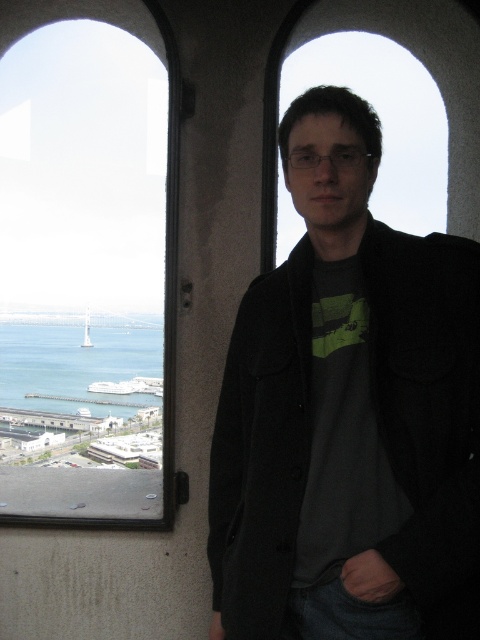
You are an interior designer assessing the space. You need to determine if the transparent glass window at upper left can accommodate a decorative shelf that is the same width as the black woolen jacket at center. Can the window fit the shelf?

The transparent glass window at upper left is wider than the black woolen jacket at center, so the shelf with the same width as the jacket can fit on the window.

You are an interior designer assessing the space. The black woolen jacket at center and the blue water at lower left are both visible through the window. Which object appears taller in the scene?

The blue water at lower left appears taller than the black woolen jacket at center.

You are an architect designing a new building and want to ensure that the transparent glass window at upper left provides a clear view of the blue water at lower left. Given that the distance between them is 192.68 feet, is this distance within the optimal viewing range for such a window? Please explain your reasoning.

The transparent glass window at upper left is 192.68 feet away from the blue water at lower left. This distance may be too far for optimal viewing, as typical architectural guidelines suggest that key scenic elements should be within 100 to 150 feet to maintain clarity and visual impact. The 192.68 feet distance exceeds this range, potentially making the blue water at lower left appear smaller and less detailed from the window.